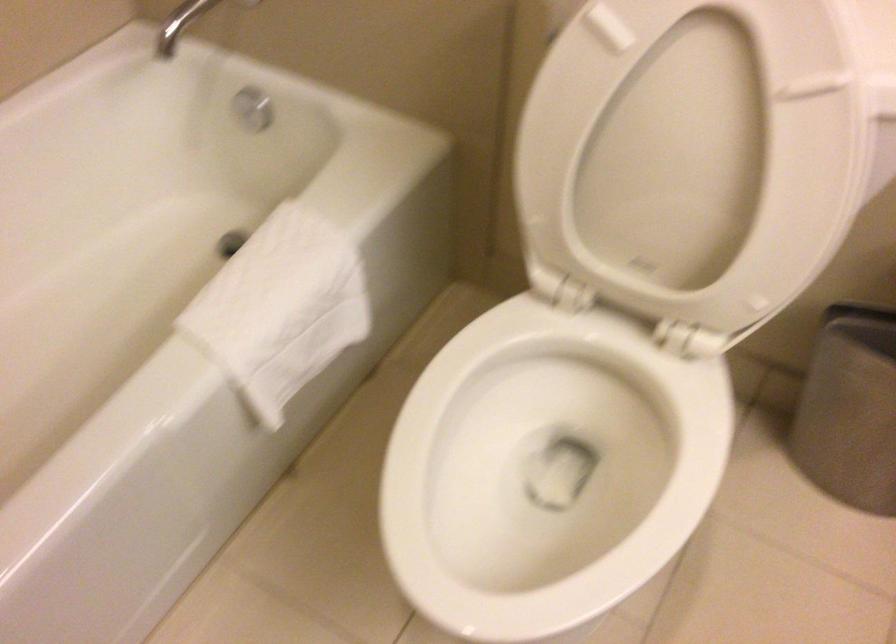
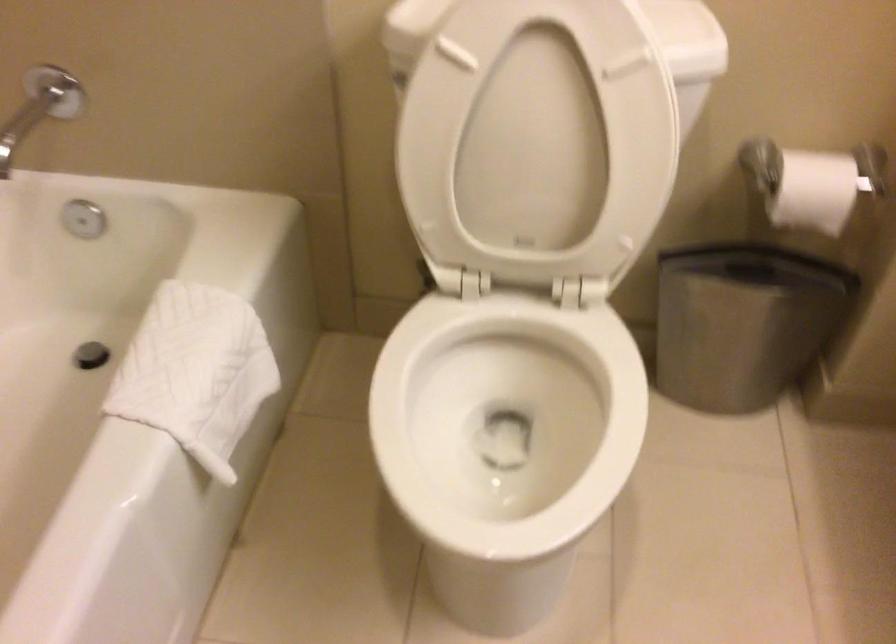
Question: The camera is either moving clockwise (left) or counter-clockwise (right) around the object. The first image is from the beginning of the video and the second image is from the end. Is the camera moving left or right when shooting the video?

Choices:
 (A) Left
 (B) Right

Answer: (A)